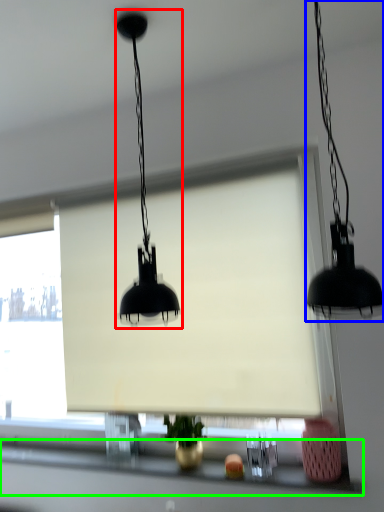
Question: Based on their relative distances, which object is farther from lamp (highlighted by a red box)? Choose from lamp (highlighted by a blue box) and window sill (highlighted by a green box).

Choices:
 (A) lamp
 (B) window sill

Answer: (B)